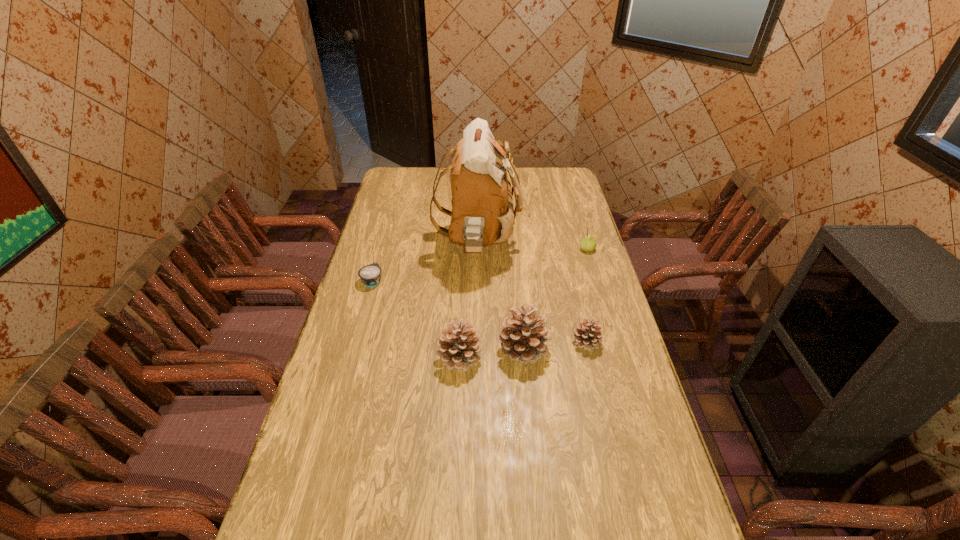
The image size is (960, 540). Identify the location of free space between the second pinecone from left to right and the leftmost pinecone. (492, 354).

Identify the location of free space between the leftmost object and the shortest pinecone. The height and width of the screenshot is (540, 960). (479, 312).

Where is `vacant area that lies between the yogurt and the tallest object`? Image resolution: width=960 pixels, height=540 pixels. vacant area that lies between the yogurt and the tallest object is located at coordinates (425, 262).

You are a GUI agent. You are given a task and a screenshot of the screen. Output one action in this format:
    pyautogui.click(x=<x>, y=<y>)
    Task: Click on the free point between the leftmost pinecone and the shortest object
    
    Given the screenshot: What is the action you would take?
    pyautogui.click(x=416, y=319)

In order to click on empty space between the leftmost object and the rightmost pinecone in this screenshot , I will do `click(479, 312)`.

Where is `the closest object to the backpack`? Image resolution: width=960 pixels, height=540 pixels. the closest object to the backpack is located at coordinates (370, 275).

You are a GUI agent. You are given a task and a screenshot of the screen. Output one action in this format:
    pyautogui.click(x=<x>, y=<y>)
    Task: Click on the closest object to the pear
    The height and width of the screenshot is (540, 960).
    Given the screenshot: What is the action you would take?
    482,213

Choose which pinecone is the nearest neighbor to the yogurt. Please provide its 2D coordinates. Your answer should be formatted as a tuple, i.e. [(x, y)], where the tuple contains the x and y coordinates of a point satisfying the conditions above.

[(458, 348)]

Identify which pinecone is the nearest to the rightmost object. Please provide its 2D coordinates. Your answer should be formatted as a tuple, i.e. [(x, y)], where the tuple contains the x and y coordinates of a point satisfying the conditions above.

[(587, 335)]

Identify the location of free location that satisfies the following two spatial constraints: 1. on the back side of the pear; 2. on the right side of the second tallest pinecone. The image size is (960, 540). (465, 249).